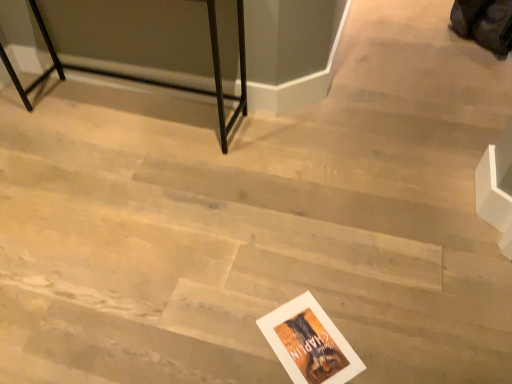
This screenshot has height=384, width=512. Find the location of `vacant point to the right of white paper postcard at lower center`. vacant point to the right of white paper postcard at lower center is located at coordinates (378, 332).